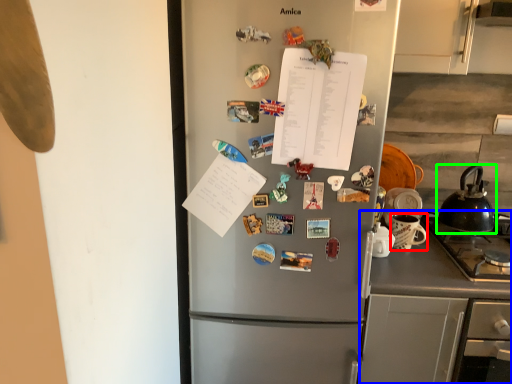
Question: Which object is positioned farthest from appliance (highlighted by a red box)? Select from counter (highlighted by a blue box) and kettle (highlighted by a green box).

Choices:
 (A) counter
 (B) kettle

Answer: (A)